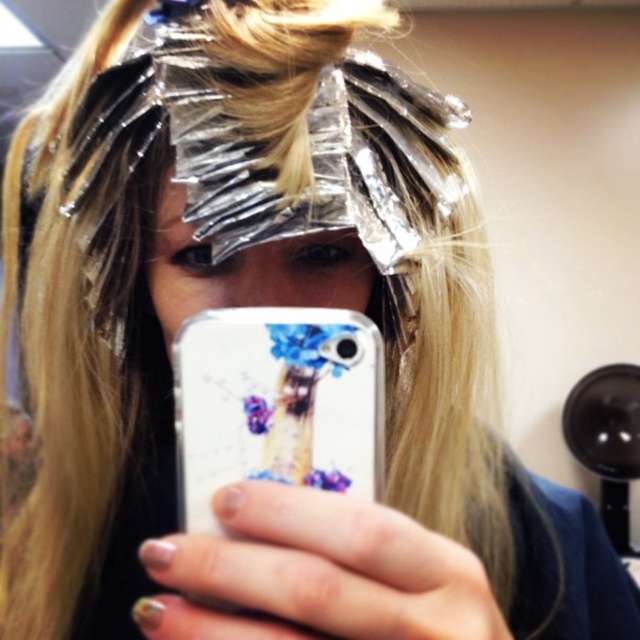
Which is more to the left, white glossy phone case at center or matte plastic face at center?

matte plastic face at center is more to the left.

I want to click on white glossy phone case at center, so click(276, 404).